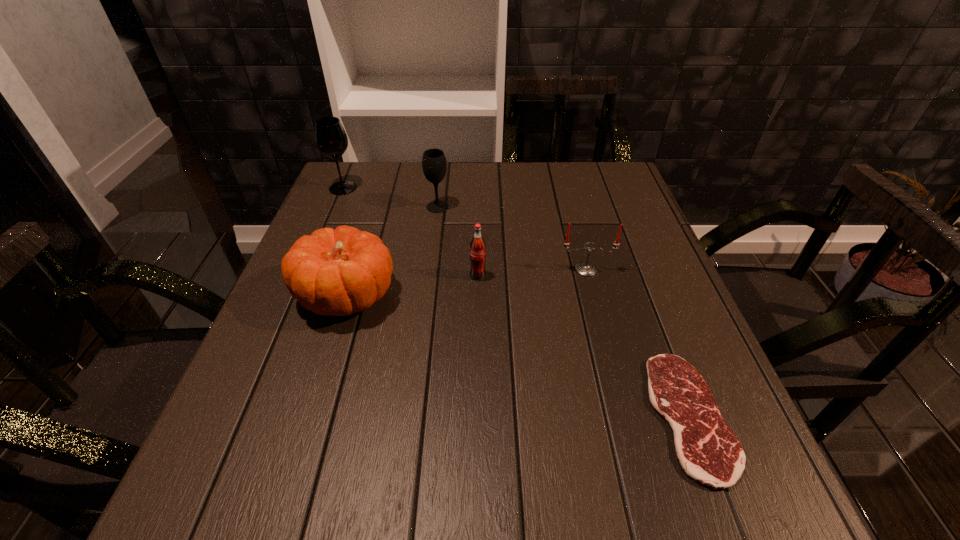
I want to click on vacant space located 0.090m on the back of the fifth nearest object, so (x=441, y=183).

The height and width of the screenshot is (540, 960). Find the location of `free space located 0.330m on the back of the pumpkin`. free space located 0.330m on the back of the pumpkin is located at coordinates (380, 186).

Identify the location of vacant point located 0.360m on the label of the third object from right to left. (477, 438).

Where is `free space located on the front-facing side of the candle`? free space located on the front-facing side of the candle is located at coordinates (602, 329).

Where is `vacant space located 0.160m on the left of the shortest object`? The height and width of the screenshot is (540, 960). vacant space located 0.160m on the left of the shortest object is located at coordinates (556, 416).

Find the location of `object at the near edge`. object at the near edge is located at coordinates (708, 451).

This screenshot has width=960, height=540. What are the coordinates of `wineglass that is at the left edge` in the screenshot? It's located at (331, 139).

This screenshot has width=960, height=540. I want to click on pumpkin that is at the left edge, so click(x=339, y=272).

Identify the location of candle located at the right edge. (585, 268).

At what (x,y) coordinates should I click in order to perform the action: click on steak that is at the right edge. Please return your answer as a coordinate pair (x, y). Looking at the image, I should click on (708, 451).